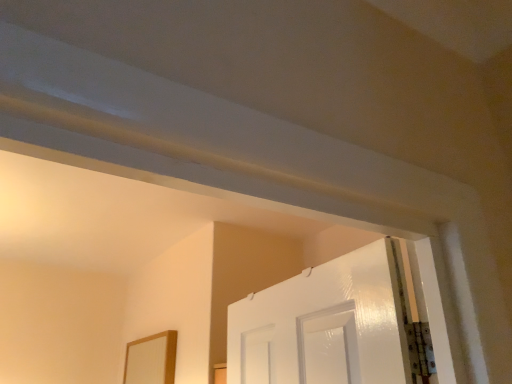
This screenshot has height=384, width=512. What do you see at coordinates (151, 359) in the screenshot? I see `wooden mirror at lower left` at bounding box center [151, 359].

This screenshot has width=512, height=384. Find the location of `wooden mirror at lower left`. wooden mirror at lower left is located at coordinates (151, 359).

This screenshot has width=512, height=384. I want to click on wooden mirror at lower left, so click(151, 359).